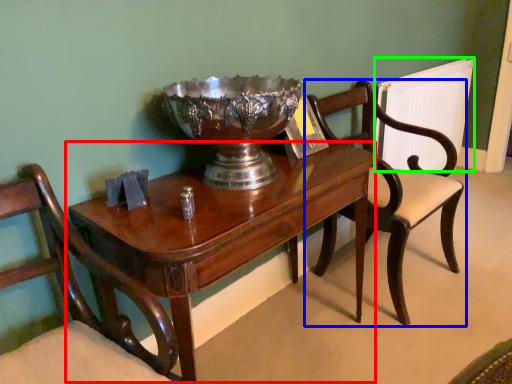
Question: Based on their relative distances, which object is nearer to table (highlighted by a red box)? Choose from chair (highlighted by a blue box) and radiator (highlighted by a green box).

Choices:
 (A) chair
 (B) radiator

Answer: (A)